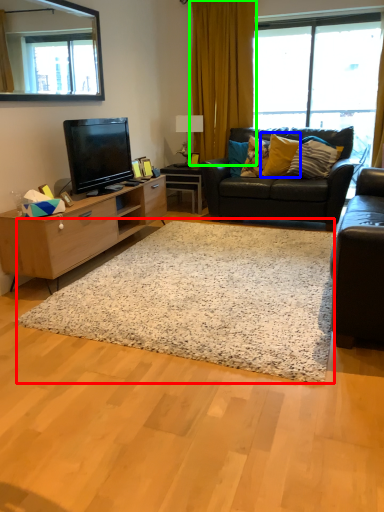
Question: Which is farther away from plain (highlighted by a red box)? pillow (highlighted by a blue box) or curtain (highlighted by a green box)?

Choices:
 (A) pillow
 (B) curtain

Answer: (B)